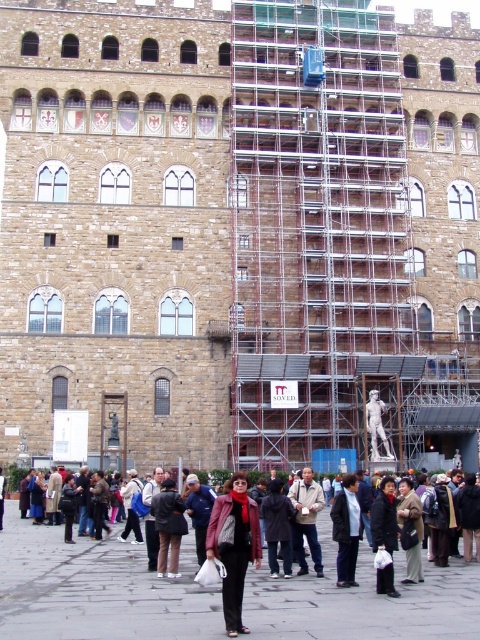
Does leather jacket at center appear under light brown leather jacket at center?

No, leather jacket at center is not below light brown leather jacket at center.

Does leather jacket at center appear over light brown leather jacket at center?

Indeed, leather jacket at center is positioned over light brown leather jacket at center.

Describe the element at coordinates (235, 547) in the screenshot. The image size is (480, 640). I see `leather jacket at center` at that location.

I want to click on leather jacket at center, so click(235, 547).

Consider the image. Is scaffolding metal at center bigger than dark brown leather jacket at lower center?

Correct, scaffolding metal at center is larger in size than dark brown leather jacket at lower center.

From the picture: Is scaffolding metal at center to the right of dark brown leather jacket at lower center from the viewer's perspective?

Yes, scaffolding metal at center is to the right of dark brown leather jacket at lower center.

Does point (244, 289) come farther from viewer compared to point (471, 618)?

Yes.

You are a GUI agent. You are given a task and a screenshot of the screen. Output one action in this format:
    pyautogui.click(x=<x>, y=<y>)
    Task: Click on the scaffolding metal at center
    This screenshot has width=480, height=640.
    Given the screenshot: What is the action you would take?
    pyautogui.click(x=314, y=221)

Between point (255, 168) and point (304, 506), which one is positioned behind?

Point (255, 168)

Is scaffolding metal at center behind light brown leather jacket at center?

Yes, it is.

Who is more forward, (394, 317) or (294, 497)?

Point (294, 497) is in front.

Identify the location of scaffolding metal at center. (314, 221).